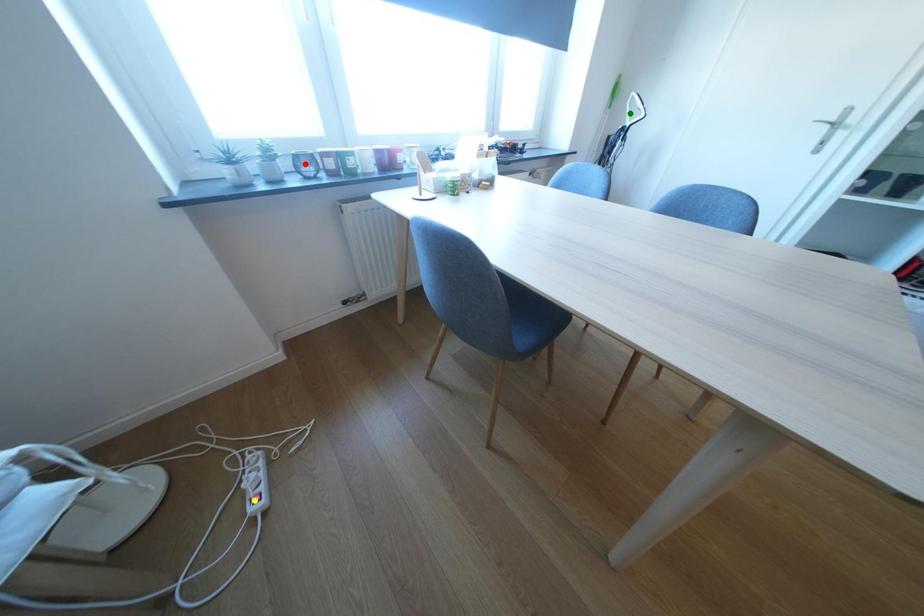
Order these from nearest to farthest:
green point
red point
yellow point

yellow point, red point, green point